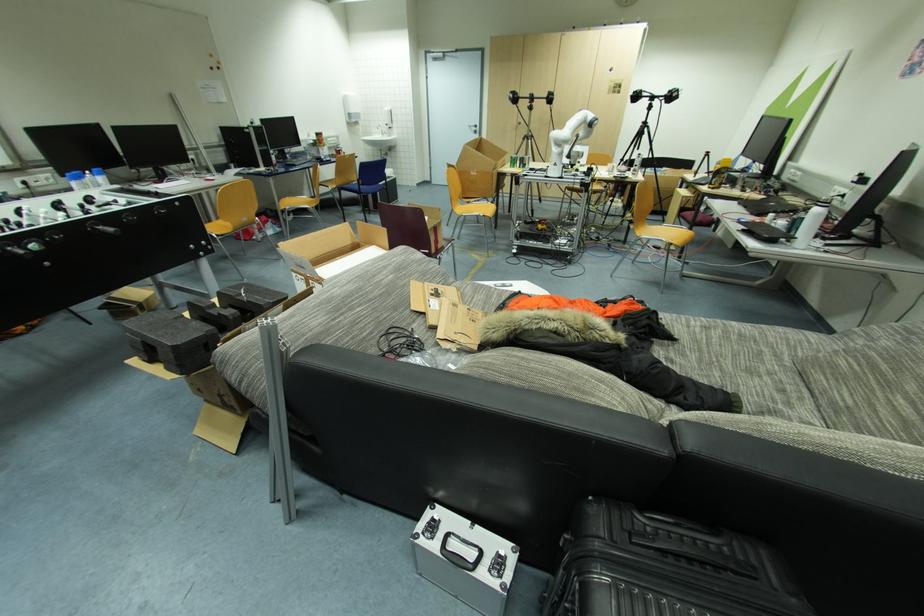
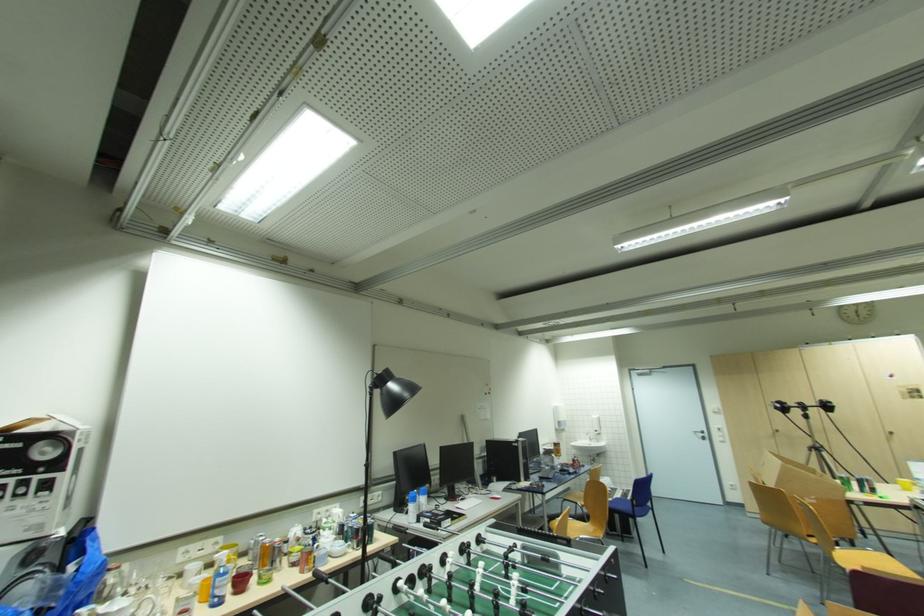
Where in the second image is the point corresponding to the point at 391,128 from the first image?

(601, 434)